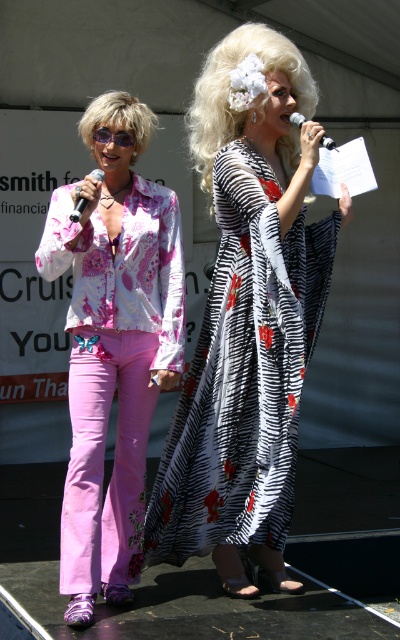
Question: Can you confirm if blonde synthetic wig at left is positioned above matte black microphone at left?

Choices:
 (A) yes
 (B) no

Answer: (A)

Question: Which is farther from the zebra-patterned fabric dress at center?

Choices:
 (A) blonde synthetic wig at left
 (B) metallic silver microphone at upper center
 (C) matte black microphone at left
 (D) pink satin blouse at center

Answer: (A)

Question: Where is zebra-patterned fabric dress at center located in relation to purple plastic goggles at left in the image?

Choices:
 (A) left
 (B) right

Answer: (B)

Question: Considering the real-world distances, which object is closest to the zebra-patterned fabric dress at center?

Choices:
 (A) purple plastic goggles at left
 (B) matte black microphone at left
 (C) blonde synthetic wig at left
 (D) blonde synthetic wig at upper center

Answer: (D)

Question: Which point is closer to the camera taking this photo?

Choices:
 (A) (328, 145)
 (B) (148, 557)

Answer: (A)

Question: Can you confirm if matte black microphone at left is positioned below metallic silver microphone at upper center?

Choices:
 (A) no
 (B) yes

Answer: (B)